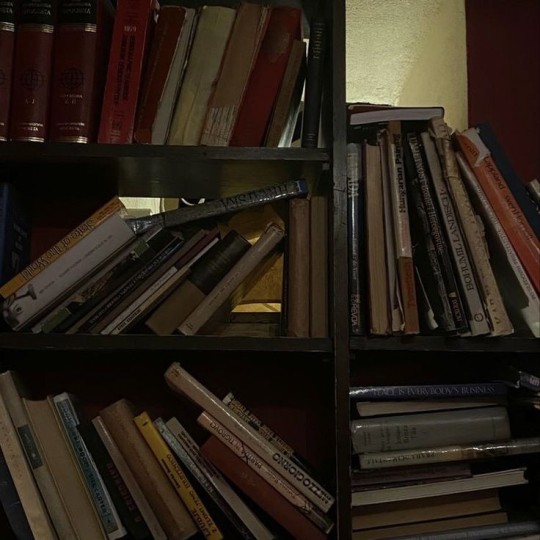
Find the location of `yellow wall`. yellow wall is located at coordinates (406, 79).